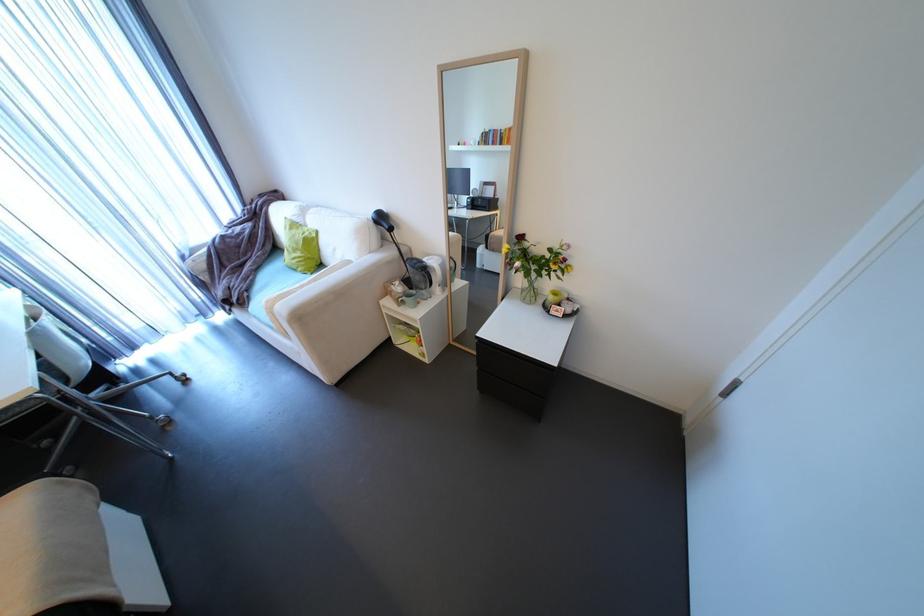
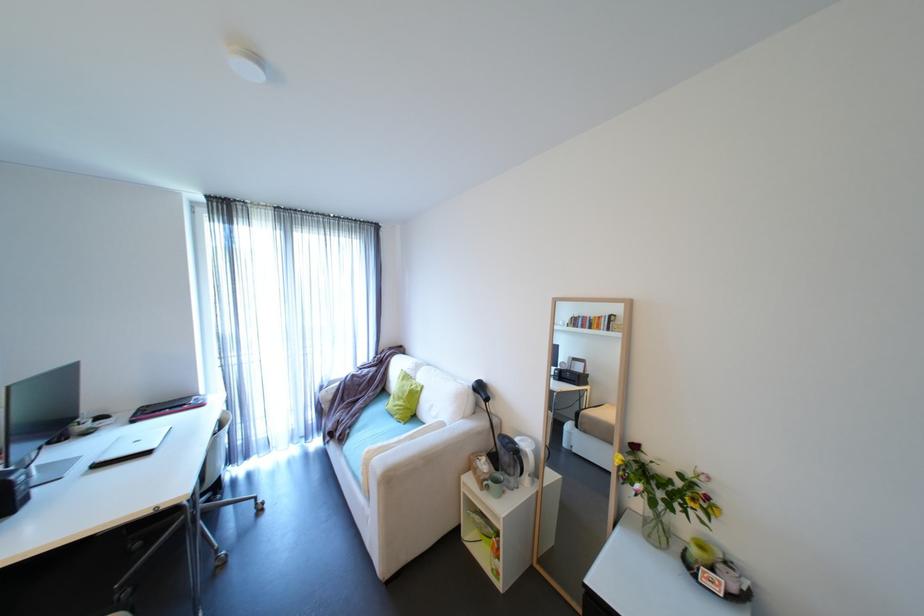
The point at (434, 260) is marked in the first image. Where is the corresponding point in the second image?

(527, 440)